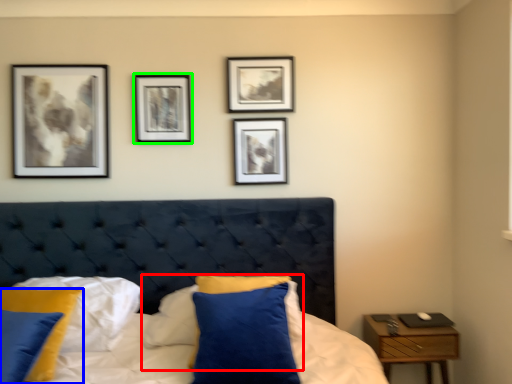
Question: Considering the real-world distances, which object is farthest from pillow (highlighted by a red box)? pillow (highlighted by a blue box) or picture frame (highlighted by a green box)?

Choices:
 (A) pillow
 (B) picture frame

Answer: (B)